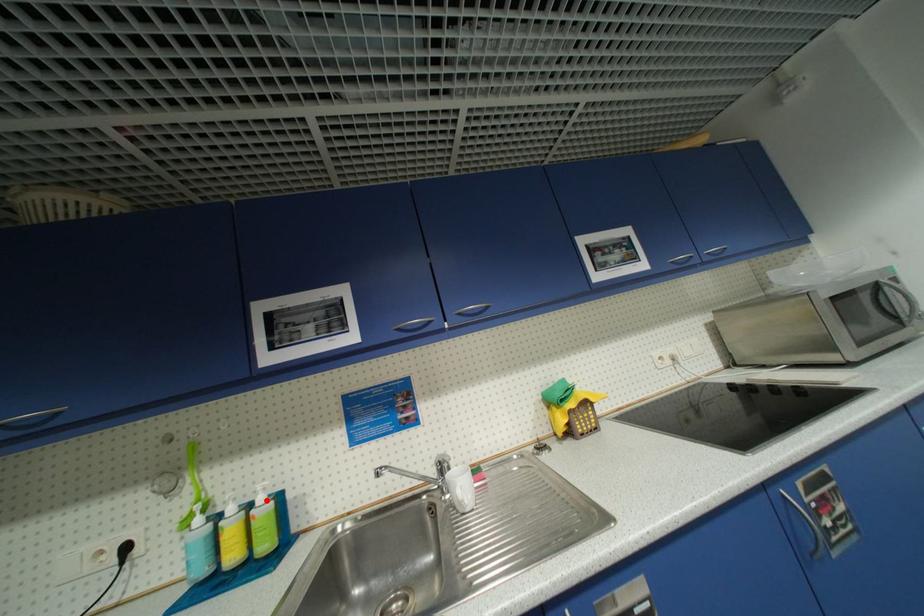
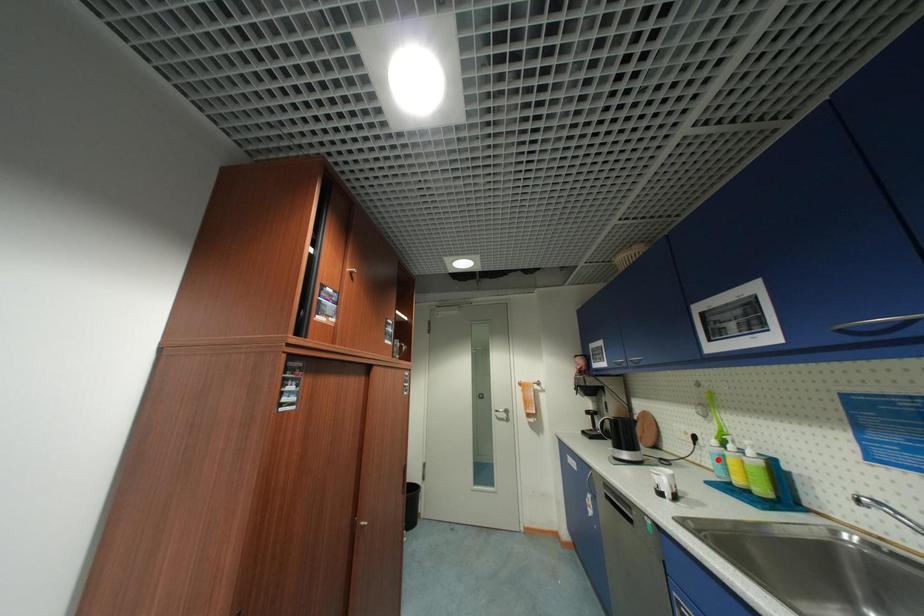
I am providing you with two images of the same scene from different viewpoints. A red point is marked on the first image and another point is marked on the second image. Are the points marked in image1 and image2 representing the same 3D position?

No